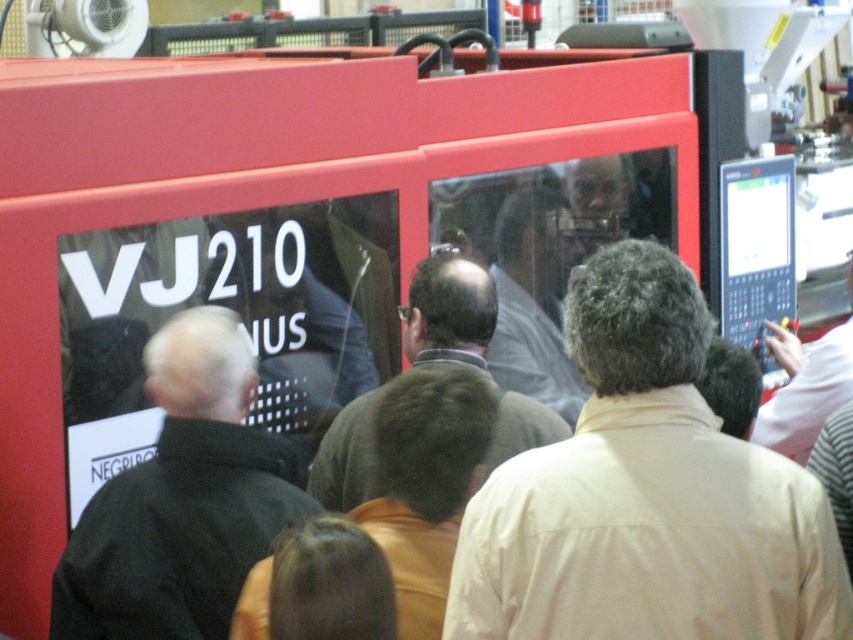
You are standing in front of the VJ210 machine and notice two people in the scene. Which person is wearing a larger garment, the one with the black matte jacket at left or the light gray shirt at center?

The black matte jacket at left is bigger than the light gray shirt at center.

You are standing at the center of the image and want to place a new object at point (450, 310). What is currently located at that point?

The dark brown sweater at center is located at point (450, 310).